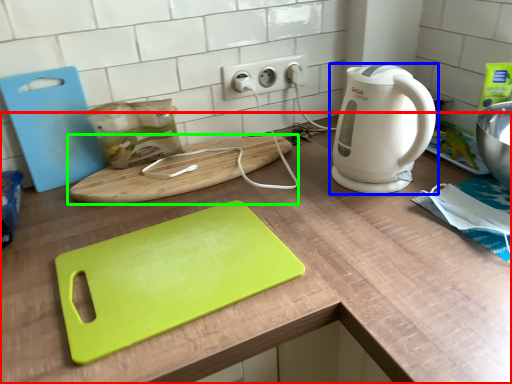
Question: Which object is the farthest from counter (highlighted by a red box)? Choose among these: home appliance (highlighted by a blue box) or cutting board (highlighted by a green box).

Choices:
 (A) home appliance
 (B) cutting board

Answer: (A)